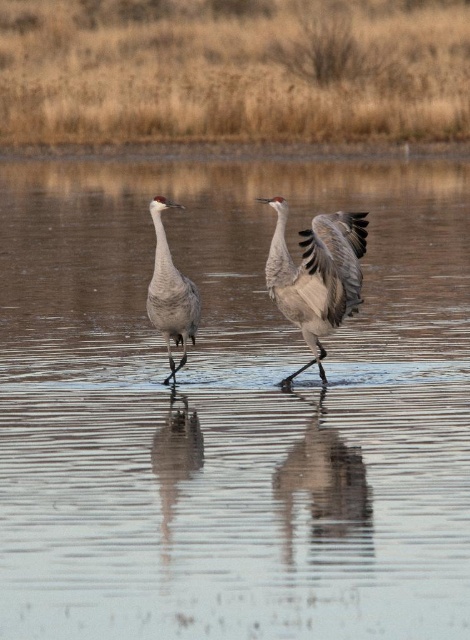
You are a birdwatcher observing the gray feathered crane at center and the brown grass at upper center. Which object is taller in the scene?

The brown grass at upper center is taller than the gray feathered crane at center.

You are a birdwatcher observing two birds in a marsh. You see the gray feathered crane at center and the gray matte goose at center. Which bird is positioned to the right?

The gray feathered crane at center is positioned to the right of the gray matte goose at center.

You are a photographer trying to capture a landscape shot of the brown grass at upper center and the gray feathered crane at center. Which object is wider in the image?

The brown grass at upper center is wider than the gray feathered crane at center.